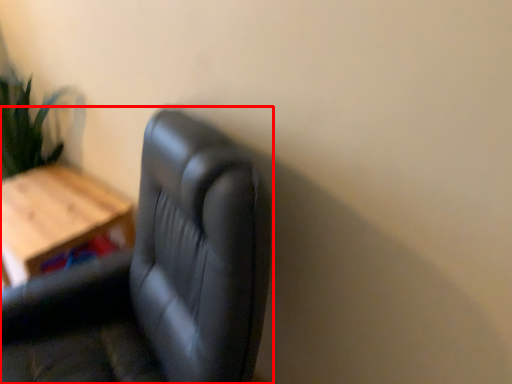
Question: In this image, where is chair (annotated by the red box) located relative to table?

Choices:
 (A) right
 (B) left

Answer: (A)